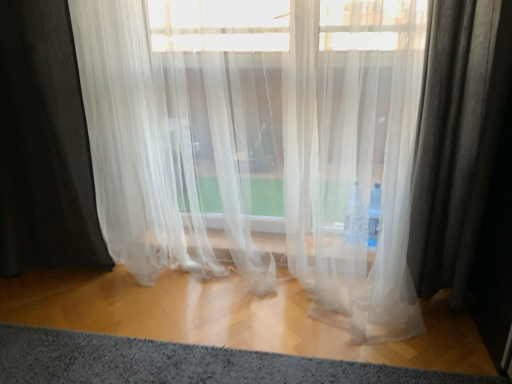
Question: Is point (117, 253) closer or farther from the camera than point (340, 379)?

Choices:
 (A) closer
 (B) farther

Answer: (B)

Question: In terms of height, does translucent white curtain at center look taller or shorter compared to gray soft rug at lower center?

Choices:
 (A) short
 (B) tall

Answer: (B)

Question: In terms of width, does translucent white curtain at center look wider or thinner when compared to gray soft rug at lower center?

Choices:
 (A) wide
 (B) thin

Answer: (A)

Question: From their relative heights in the image, would you say gray soft rug at lower center is taller or shorter than translucent white curtain at center?

Choices:
 (A) short
 (B) tall

Answer: (A)

Question: In the image, is gray soft rug at lower center positioned in front of or behind translucent white curtain at center?

Choices:
 (A) front
 (B) behind

Answer: (A)

Question: From a real-world perspective, is gray soft rug at lower center physically located above or below translucent white curtain at center?

Choices:
 (A) above
 (B) below

Answer: (B)

Question: Does point (61, 344) appear closer or farther from the camera than point (209, 29)?

Choices:
 (A) farther
 (B) closer

Answer: (B)